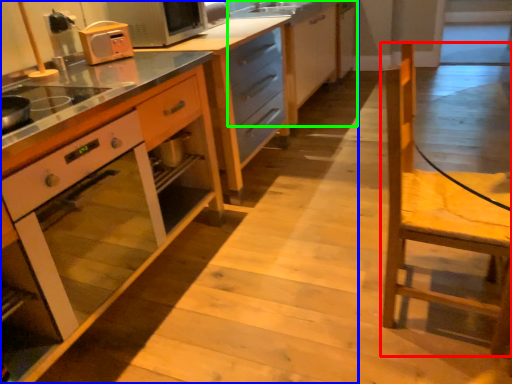
Question: Which object is the closest to the chair (highlighted by a red box)? Choose among these: cabinetry (highlighted by a blue box) or cabinetry (highlighted by a green box).

Choices:
 (A) cabinetry
 (B) cabinetry

Answer: (A)